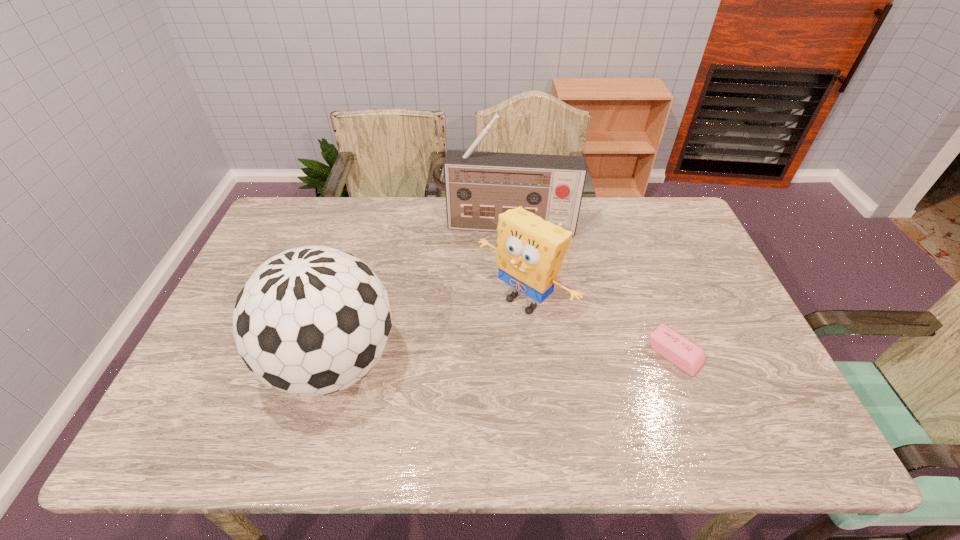
Where is `free area in between the leftmost object and the radio receiver`? The height and width of the screenshot is (540, 960). free area in between the leftmost object and the radio receiver is located at coordinates (420, 295).

Where is `object that can be found as the third closest to the second shortest object`? This screenshot has height=540, width=960. object that can be found as the third closest to the second shortest object is located at coordinates (310, 321).

At what (x,y) coordinates should I click in order to perform the action: click on object that stands as the third closest to the eraser. Please return your answer as a coordinate pair (x, y). The image size is (960, 540). Looking at the image, I should click on (310, 321).

The width and height of the screenshot is (960, 540). In order to click on vacant space that satisfies the following two spatial constraints: 1. on the back side of the farthest object; 2. on the right side of the third shortest object in this screenshot , I will do [x=372, y=227].